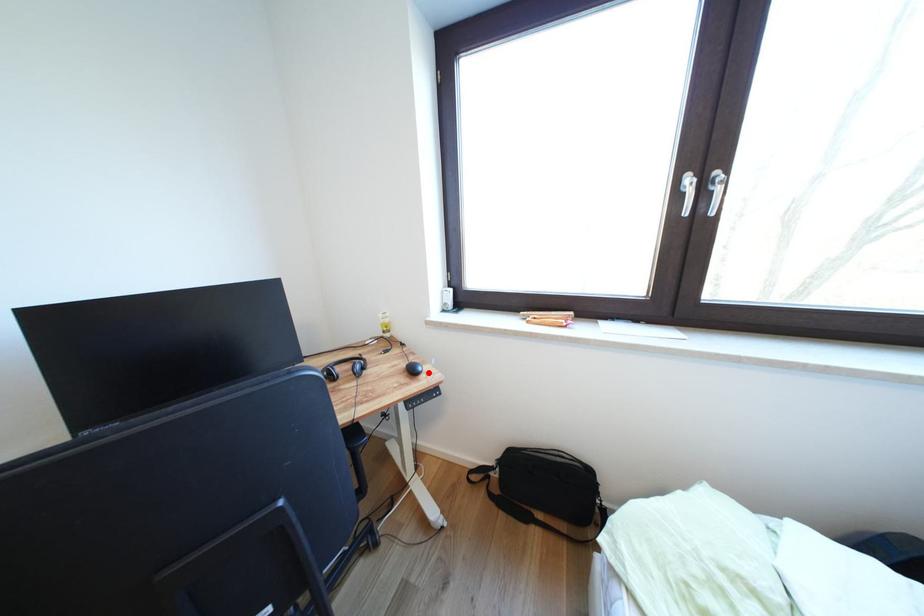
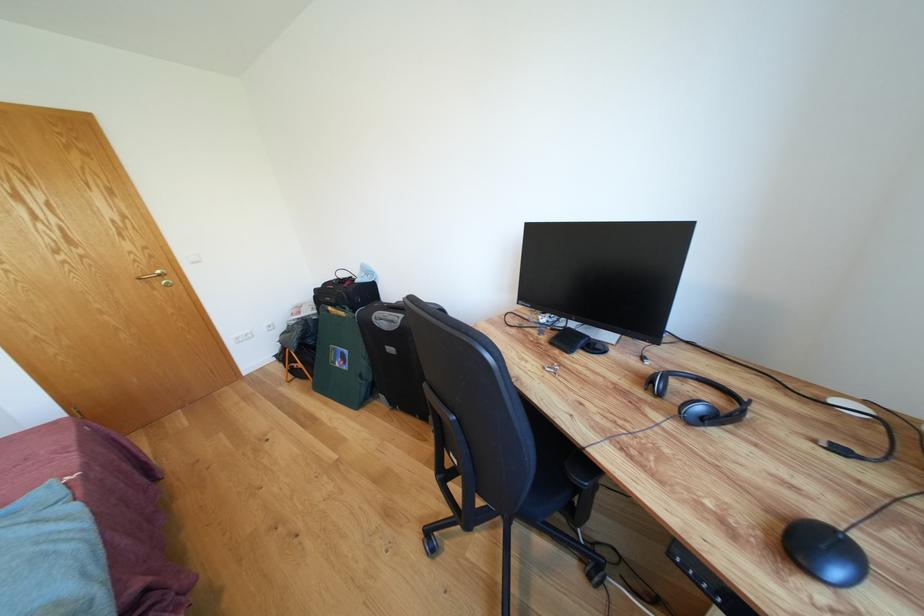
Question: A red point is marked in image1. In image2, is the corresponding 3D point closer to the camera or farther? Reply with the corresponding letter.

Choices:
 (A) The corresponding 3D point is closer.
 (B) The corresponding 3D point is farther.

Answer: (A)